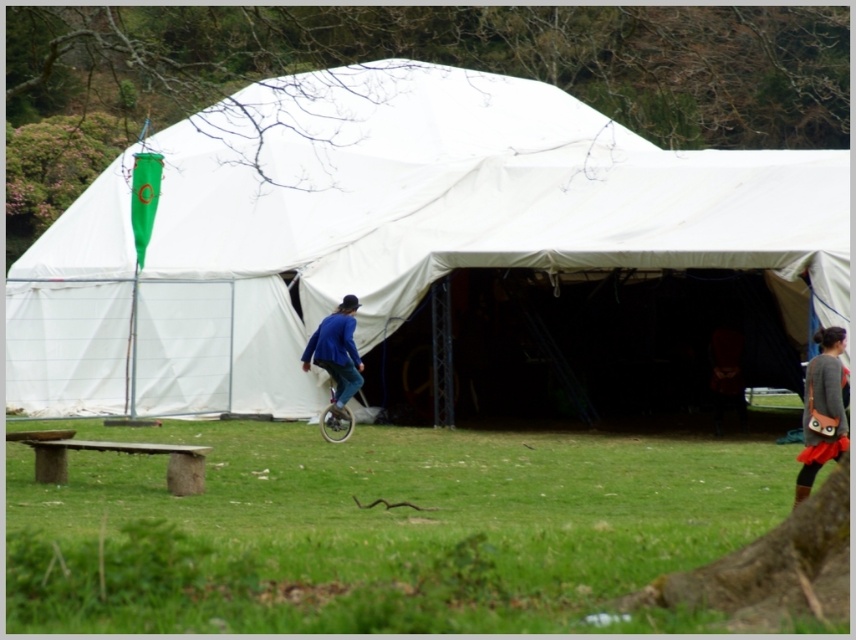
Question: Does green grass at lower center have a larger size compared to blue fabric unicycle at center?

Choices:
 (A) no
 (B) yes

Answer: (B)

Question: Does gray fabric skirt at right have a lesser width compared to blue fabric unicycle at center?

Choices:
 (A) no
 (B) yes

Answer: (B)

Question: Is white fabric tent at center smaller than green grass at lower center?

Choices:
 (A) yes
 (B) no

Answer: (B)

Question: Which point is closer to the camera?

Choices:
 (A) (336, 387)
 (B) (201, 572)
 (C) (837, 388)

Answer: (B)

Question: Considering the real-world distances, which object is closest to the metallic silver unicycle at center?

Choices:
 (A) white fabric tent at center
 (B) blue fabric unicycle at center

Answer: (B)

Question: Which object is farther from the camera taking this photo?

Choices:
 (A) blue fabric unicycle at center
 (B) white fabric tent at center
 (C) gray fabric skirt at right
 (D) metallic silver unicycle at center

Answer: (A)